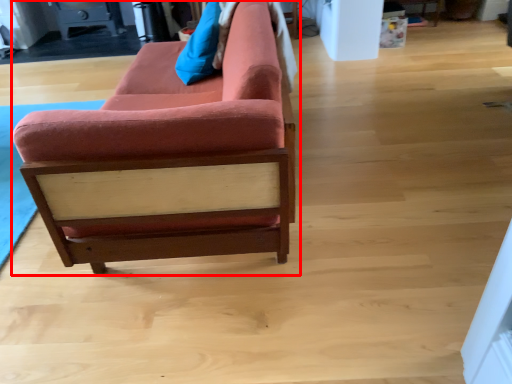
Question: From the image's perspective, where is studio couch (annotated by the red box) located in relation to pillow in the image?

Choices:
 (A) above
 (B) below

Answer: (B)